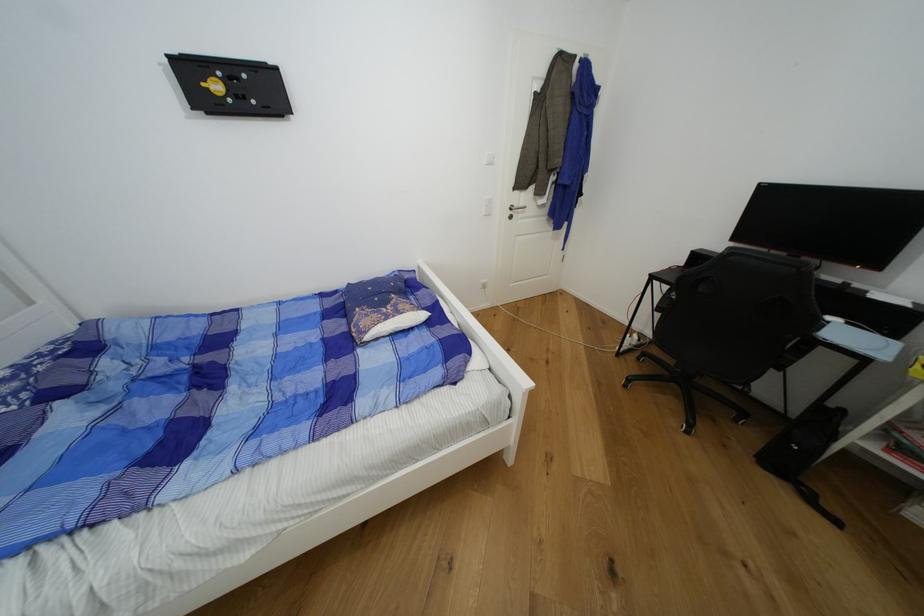
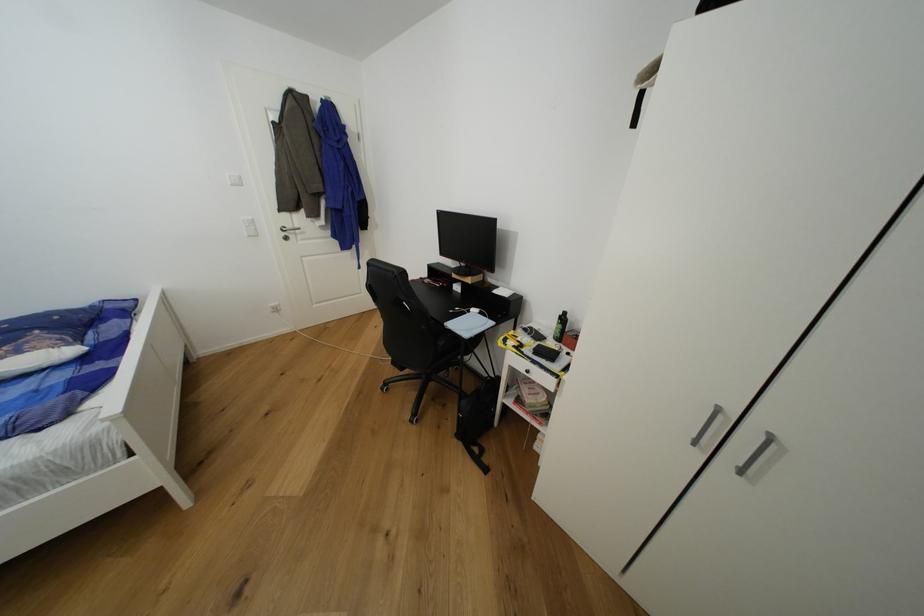
Question: The images are taken continuously from a first-person perspective. In which direction are you moving?

Choices:
 (A) Left
 (B) Right
 (C) Forward
 (D) Backward

Answer: (B)